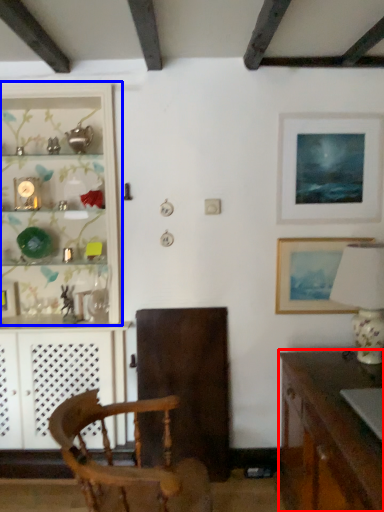
Question: Among these objects, which one is nearest to the camera, desk (highlighted by a red box) or shelf (highlighted by a blue box)?

Choices:
 (A) desk
 (B) shelf

Answer: (A)